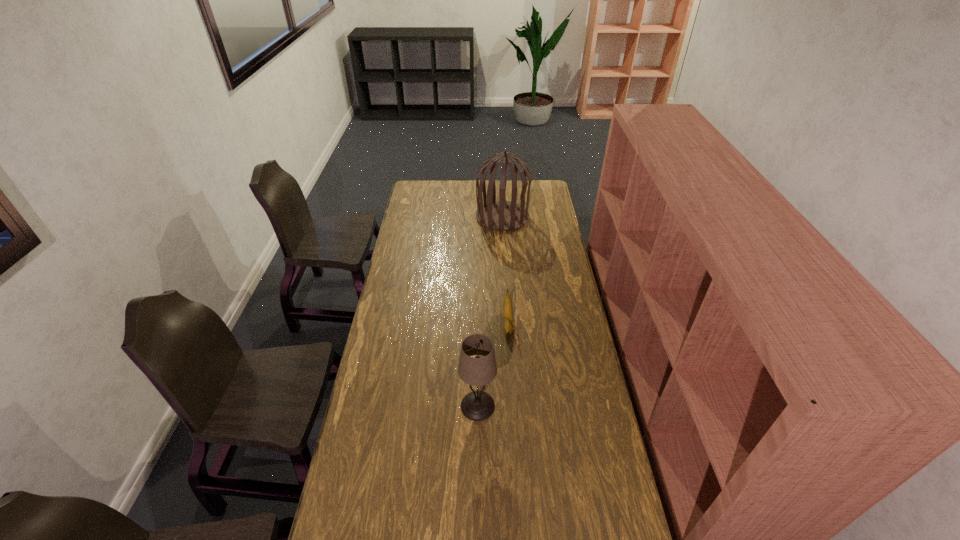
The width and height of the screenshot is (960, 540). Identify the location of free space at the far edge of the desktop. 483,193.

In the image, there is a desktop. What are the coordinates of `free region at the left edge` in the screenshot? It's located at (366, 458).

This screenshot has height=540, width=960. What are the coordinates of `free space at the right edge of the desktop` in the screenshot? It's located at (560, 235).

The image size is (960, 540). I want to click on vacant space at the far left corner, so click(434, 182).

Locate an element on the screen. The image size is (960, 540). vacant area at the far right corner of the desktop is located at coordinates (531, 197).

Where is `free space that is in between the second farthest object and the birdcage`? Image resolution: width=960 pixels, height=540 pixels. free space that is in between the second farthest object and the birdcage is located at coordinates (505, 272).

Locate an element on the screen. free space between the banana and the birdcage is located at coordinates (505, 272).

Where is `empty space between the tallest object and the nearest object`? This screenshot has width=960, height=540. empty space between the tallest object and the nearest object is located at coordinates (490, 312).

Identify the location of free point between the farthest object and the lampshade. (490, 312).

This screenshot has width=960, height=540. I want to click on vacant space that is in between the farthest object and the banana, so click(x=505, y=272).